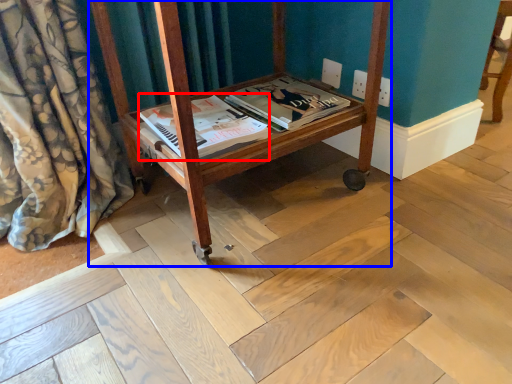
Question: Which object appears closest to the camera in this image, magazine (highlighted by a red box) or furniture (highlighted by a blue box)?

Choices:
 (A) magazine
 (B) furniture

Answer: (B)